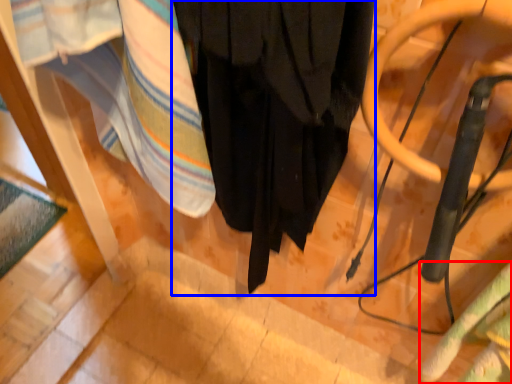
Question: Which point is further to the camera, blanket (highlighted by a red box) or curtain (highlighted by a blue box)?

Choices:
 (A) blanket
 (B) curtain

Answer: (A)